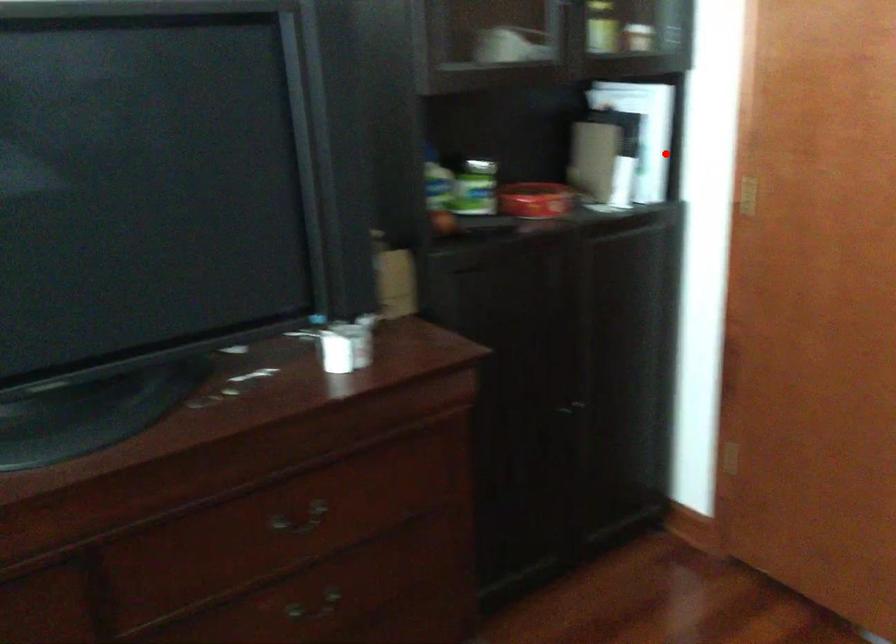
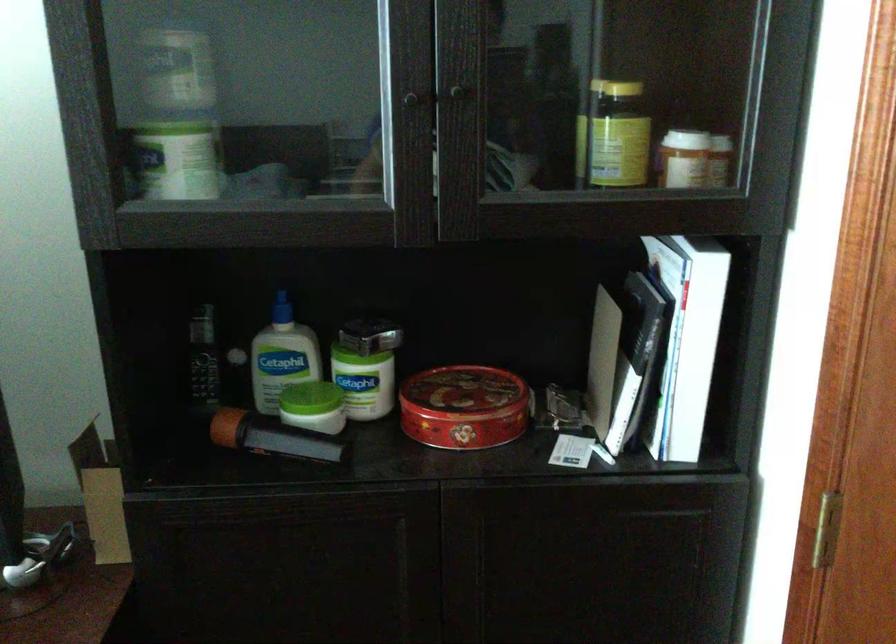
Question: I am providing you with two images of the same scene from different viewpoints. A red point is shown in image1. For the corresponding object point in image2, is it positioned nearer or farther from the camera?

Choices:
 (A) Nearer
 (B) Farther

Answer: (A)